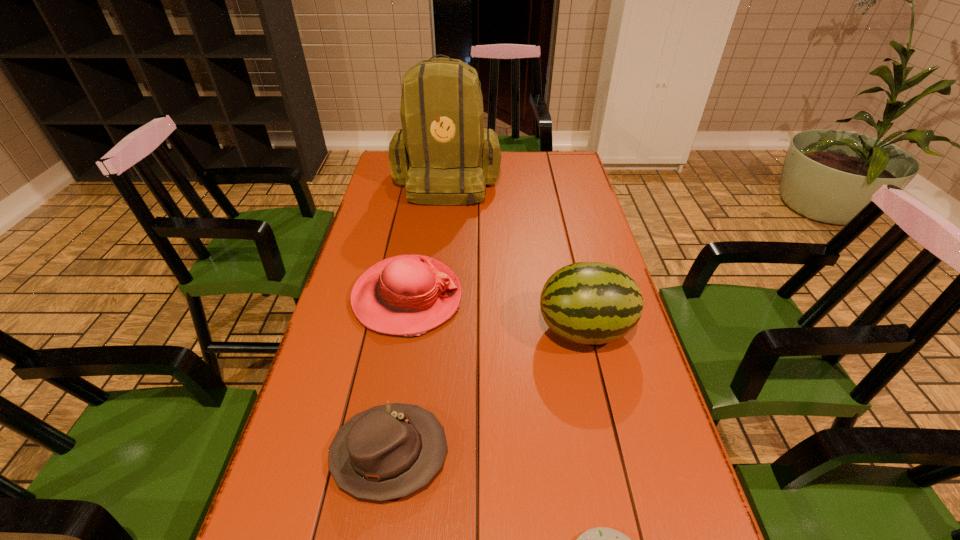
I want to click on vacant region that satisfies the following two spatial constraints: 1. on the front-facing side of the backpack; 2. on the decorative side of the nearer hat, so click(x=418, y=454).

You are a GUI agent. You are given a task and a screenshot of the screen. Output one action in this format:
    pyautogui.click(x=<x>, y=<y>)
    Task: Click on the vacant area in the image that satisfies the following two spatial constraints: 1. on the front-facing side of the farthest object; 2. at the front of the taller hat with a bow
    The height and width of the screenshot is (540, 960).
    Given the screenshot: What is the action you would take?
    pyautogui.click(x=434, y=298)

The height and width of the screenshot is (540, 960). Find the location of `vacant space that satisfies the following two spatial constraints: 1. on the front-facing side of the tallest object; 2. on the decorative side of the second shortest object`. vacant space that satisfies the following two spatial constraints: 1. on the front-facing side of the tallest object; 2. on the decorative side of the second shortest object is located at coordinates (418, 454).